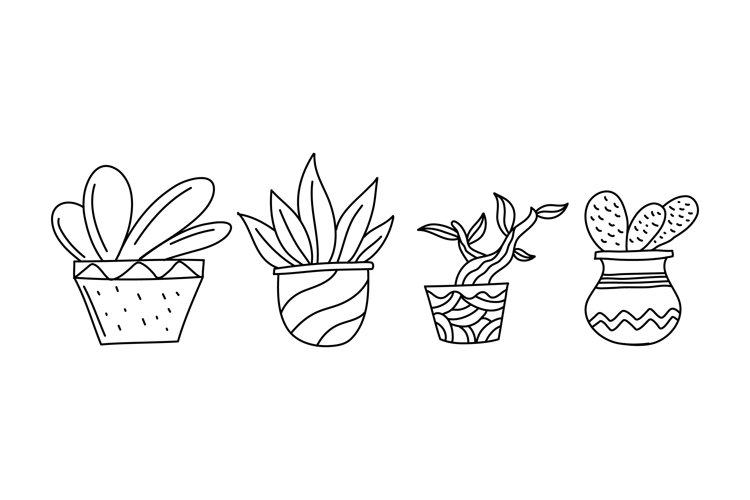
The width and height of the screenshot is (750, 500). Identify the location of third vase. (470, 314).